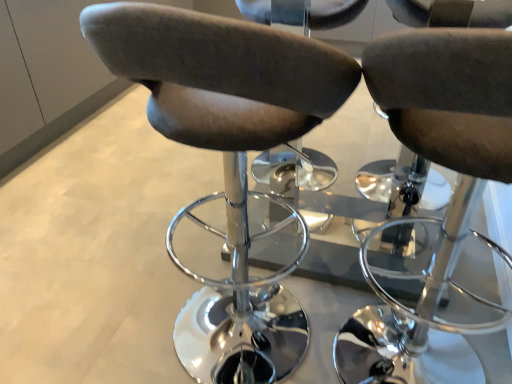
Question: Is suede-like brown chair at center, acting as the first chair starting from the left, taller or shorter than suede-like brown chair at center, the second chair from the left?

Choices:
 (A) short
 (B) tall

Answer: (B)

Question: Considering the positions of point (137, 26) and point (390, 359), is point (137, 26) closer or farther from the camera than point (390, 359)?

Choices:
 (A) closer
 (B) farther

Answer: (A)

Question: Is suede-like brown chair at center, the second chair in the right-to-left sequence, inside the boundaries of suede-like brown chair at center, the second chair from the left, or outside?

Choices:
 (A) inside
 (B) outside

Answer: (B)

Question: In terms of size, does suede-like brown chair at center, the second chair from the left, appear bigger or smaller than suede-like brown chair at center, acting as the first chair starting from the left?

Choices:
 (A) big
 (B) small

Answer: (B)

Question: Choose the correct answer: Is suede-like brown chair at center, which is the 1th chair in right-to-left order, inside suede-like brown chair at center, acting as the first chair starting from the left, or outside it?

Choices:
 (A) outside
 (B) inside

Answer: (A)

Question: From the image's perspective, is suede-like brown chair at center, the second chair from the left, above or below suede-like brown chair at center, the second chair in the right-to-left sequence?

Choices:
 (A) above
 (B) below

Answer: (B)

Question: Is point (374, 288) positioned closer to the camera than point (302, 114)?

Choices:
 (A) closer
 (B) farther

Answer: (B)